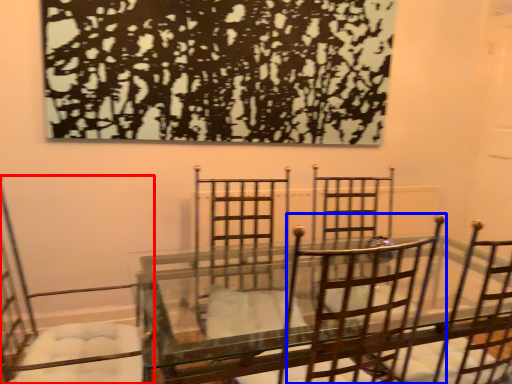
Question: Which object appears closest to the camera in this image, chair (highlighted by a red box) or chair (highlighted by a blue box)?

Choices:
 (A) chair
 (B) chair

Answer: (B)